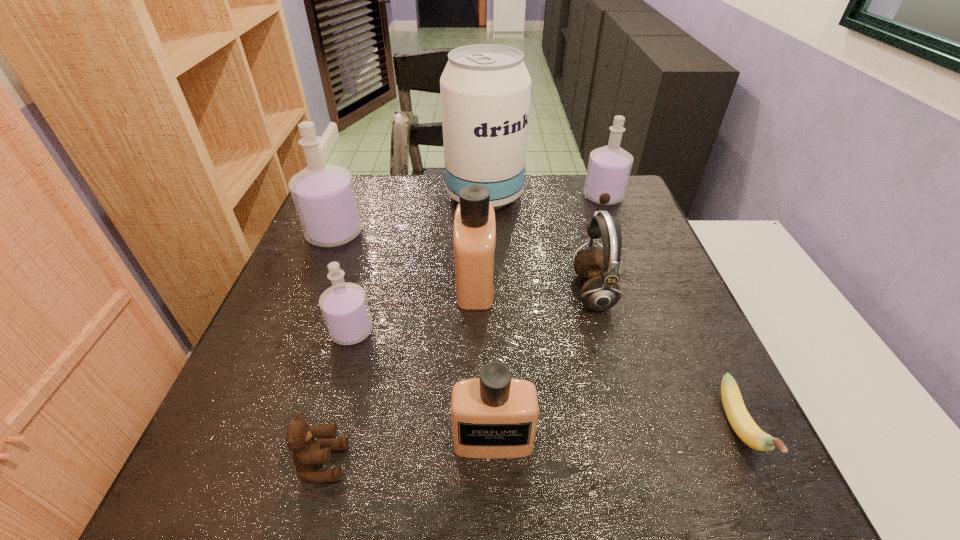
Find the location of a particular element. The height and width of the screenshot is (540, 960). perfume present at the right edge is located at coordinates tap(609, 167).

The width and height of the screenshot is (960, 540). Find the location of `earphone that is at the right edge`. earphone that is at the right edge is located at coordinates (601, 292).

Where is `banana that is at the right edge`? This screenshot has height=540, width=960. banana that is at the right edge is located at coordinates tap(740, 420).

Where is `object situated at the far left corner`? This screenshot has width=960, height=540. object situated at the far left corner is located at coordinates (324, 197).

Where is `object that is at the far right corner`? object that is at the far right corner is located at coordinates (609, 167).

I want to click on object at the near right corner, so click(740, 420).

Locate an element on the screen. Image resolution: width=960 pixels, height=540 pixels. vacant area at the far edge is located at coordinates (412, 213).

In the image, there is a desktop. Where is `blank space at the left edge`? This screenshot has width=960, height=540. blank space at the left edge is located at coordinates (256, 403).

Locate an element on the screen. This screenshot has width=960, height=540. free space at the right edge is located at coordinates (665, 390).

Locate an element on the screen. The height and width of the screenshot is (540, 960). free space at the near right corner is located at coordinates (662, 455).